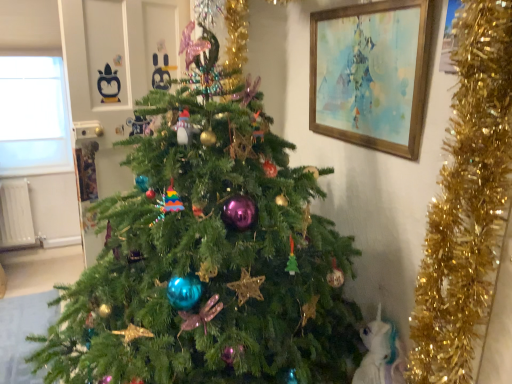
Question: Looking at the image, does wooden framed painting at upper right seem bigger or smaller compared to white feathered bird at lower right?

Choices:
 (A) big
 (B) small

Answer: (A)

Question: In terms of height, does wooden framed painting at upper right look taller or shorter compared to white feathered bird at lower right?

Choices:
 (A) tall
 (B) short

Answer: (A)

Question: Based on their relative distances, which object is nearer to the white feathered bird at lower right?

Choices:
 (A) green matte christmas tree at center
 (B) transparent glass window at upper left
 (C) wooden framed painting at upper right

Answer: (A)

Question: Which object is positioned closest to the wooden framed painting at upper right?

Choices:
 (A) transparent glass window at upper left
 (B) green matte christmas tree at center
 (C) white feathered bird at lower right

Answer: (B)